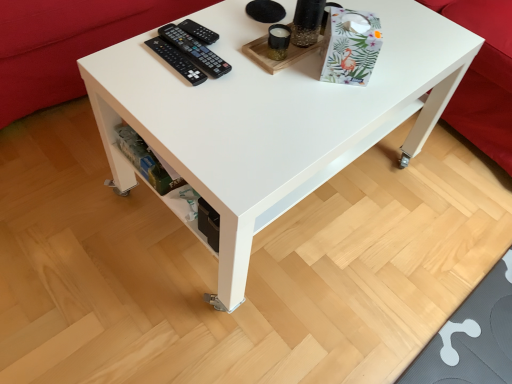
Where is `blank area to the left of black plastic remote controls at upper left, the second control in the top-to-bottom sequence`? This screenshot has width=512, height=384. blank area to the left of black plastic remote controls at upper left, the second control in the top-to-bottom sequence is located at coordinates (143, 52).